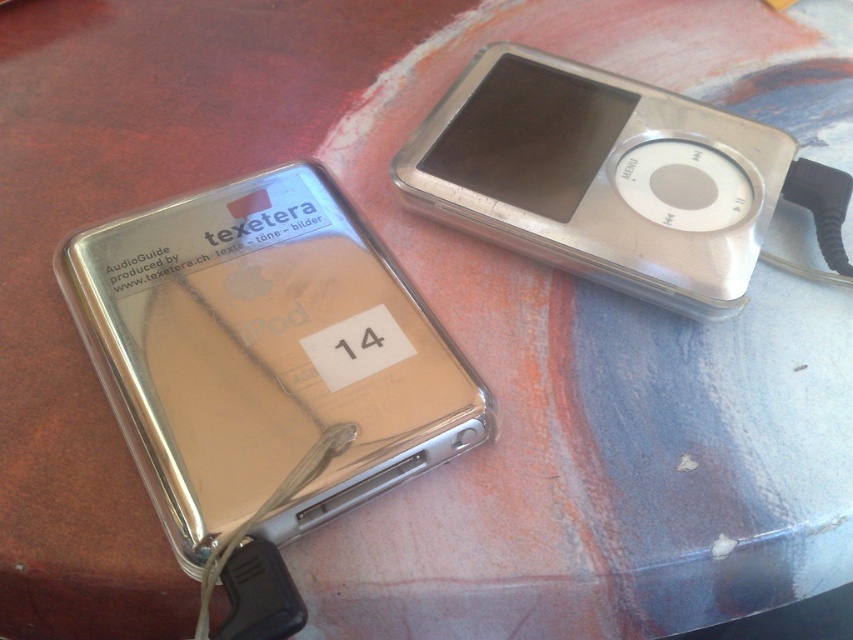
You are organizing a music event and need to place both the satin gold ipod at center and the silver metallic ipod at upper right on a shelf. If you want to arrange them so that one is visible without blocking the other, which one should you place in front?

You should place the satin gold ipod at center in front of the silver metallic ipod at upper right because the satin gold ipod at center is already positioned in front, making it visible without blocking the other.

Please provide the exact coordinates of the satin gold ipod at center in the image.

The satin gold ipod at center is located at coordinates point (264,355).

You are organizing a music event and need to choose between the satin gold ipod at center and the silver metallic ipod at upper right. Based on their sizes, which one would be more suitable for displaying prominently on a stage?

The satin gold ipod at center is larger in size than the silver metallic ipod at upper right, making it more suitable for prominent display on a stage.